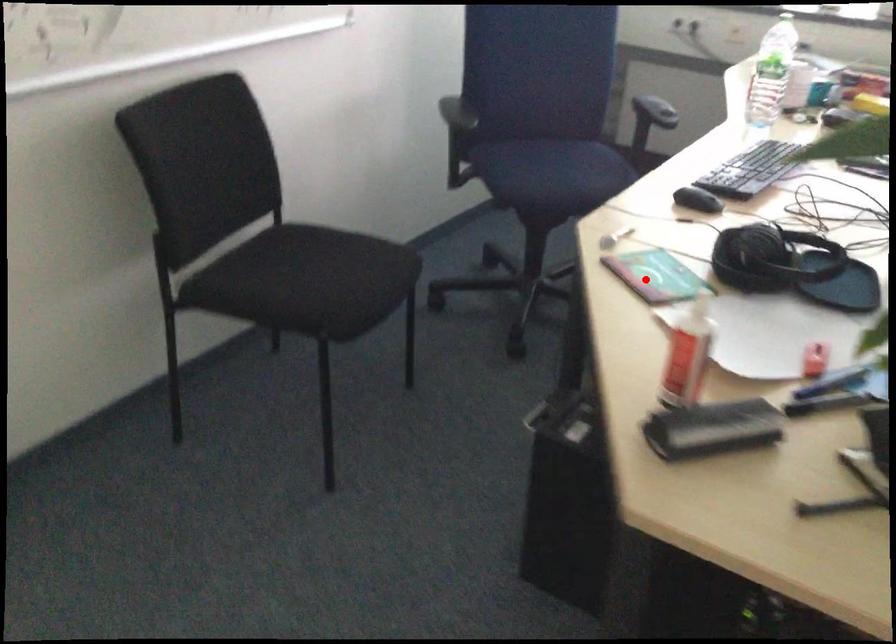
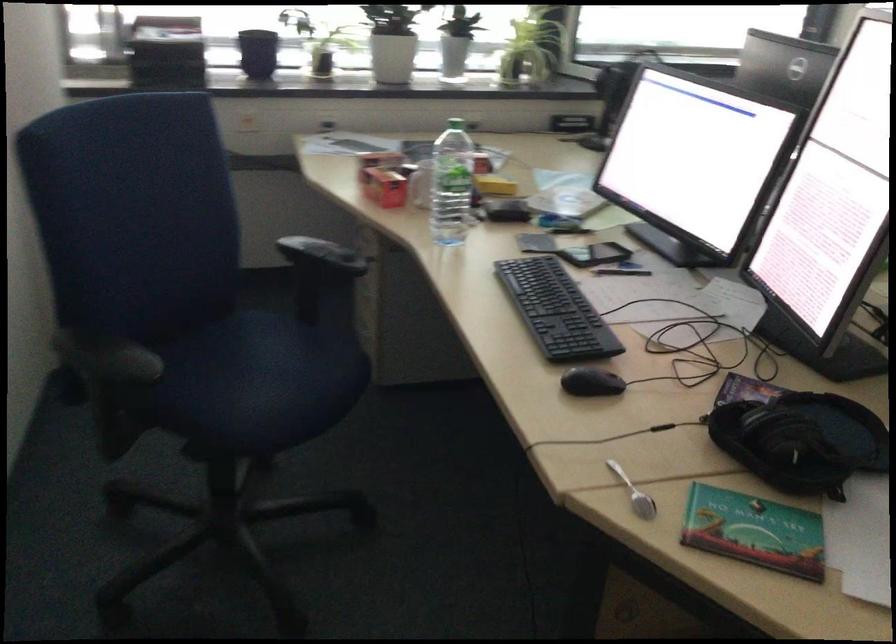
Question: I am providing you with two images of the same scene from different viewpoints. A red point is marked on the first image. Is the red point's position out of view in image 2?

Choices:
 (A) Yes
 (B) No

Answer: (B)